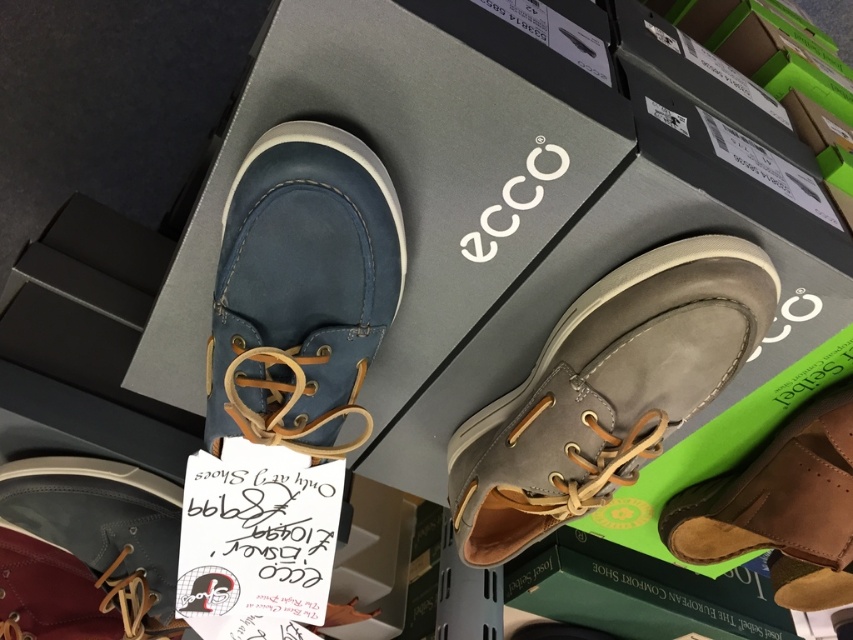
Question: Which object is closer to the camera taking this photo?

Choices:
 (A) matte blue leather shoe at upper left
 (B) gray suede shoe at center

Answer: (A)

Question: Which object appears closest to the camera in this image?

Choices:
 (A) matte blue leather shoe at upper left
 (B) brown leather shoe at lower right
 (C) gray suede shoe at center
 (D) matte leather shoe at lower left

Answer: (A)

Question: Which object is farther from the camera taking this photo?

Choices:
 (A) matte leather shoe at lower left
 (B) brown leather shoe at lower right

Answer: (B)

Question: Where is gray suede shoe at center located in relation to matte blue leather shoe at upper left in the image?

Choices:
 (A) above
 (B) below

Answer: (B)

Question: Can you confirm if gray suede shoe at center is positioned below matte blue leather shoe at upper left?

Choices:
 (A) yes
 (B) no

Answer: (A)

Question: Can you confirm if gray suede shoe at center is positioned to the left of matte blue leather shoe at upper left?

Choices:
 (A) yes
 (B) no

Answer: (B)